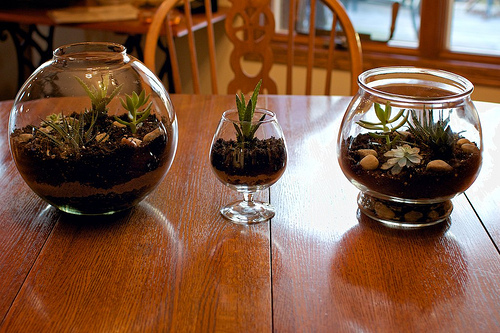
Locate an element on the screen. This screenshot has height=333, width=500. seams in wooden tabletop is located at coordinates (32, 263), (268, 260), (490, 234).